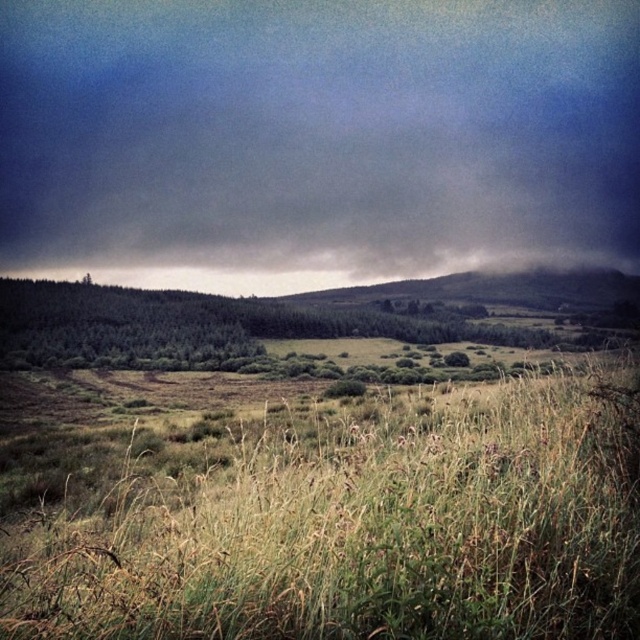
Question: Can you confirm if dark gray cloud at upper center is positioned below green grassy field at center?

Choices:
 (A) no
 (B) yes

Answer: (A)

Question: Which of the following is the closest to the observer?

Choices:
 (A) dark gray cloud at upper center
 (B) green grassy field at center

Answer: (B)

Question: Can you confirm if dark gray cloud at upper center is positioned below green grassy field at center?

Choices:
 (A) no
 (B) yes

Answer: (A)

Question: Among these points, which one is nearest to the camera?

Choices:
 (A) (492, 396)
 (B) (566, 13)

Answer: (A)

Question: Does dark gray cloud at upper center appear over green grassy field at center?

Choices:
 (A) yes
 (B) no

Answer: (A)

Question: Among these objects, which one is farthest from the camera?

Choices:
 (A) green grassy field at center
 (B) dark gray cloud at upper center

Answer: (B)